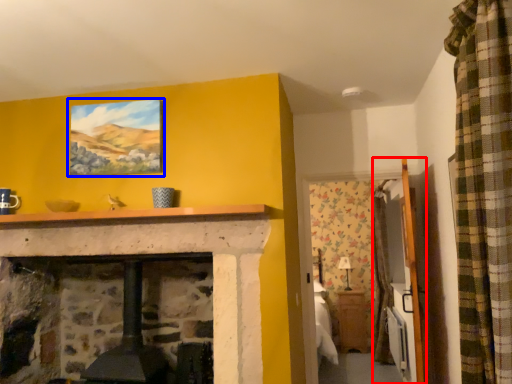
Question: Which point is closer to the camera, armoire (highlighted by a red box) or picture frame (highlighted by a blue box)?

Choices:
 (A) armoire
 (B) picture frame

Answer: (A)